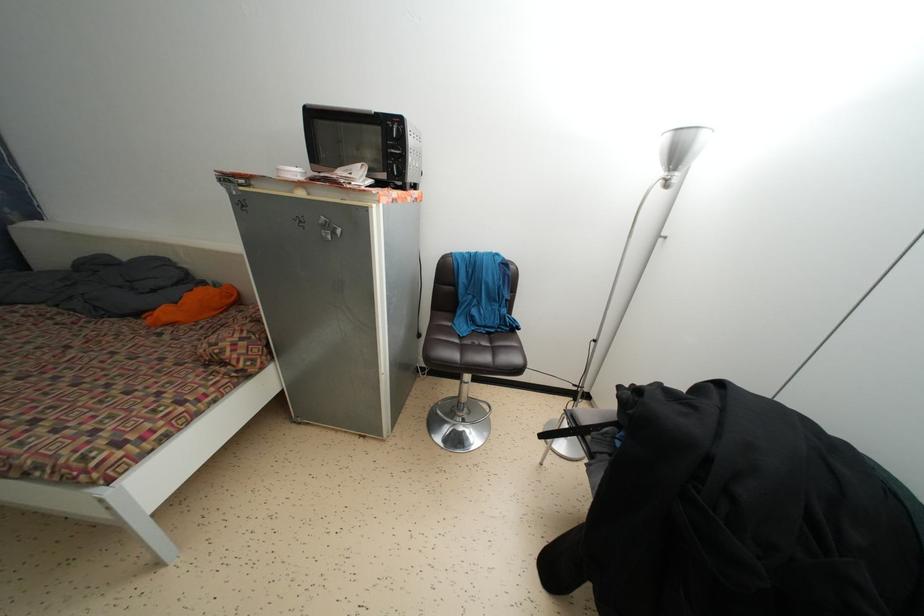
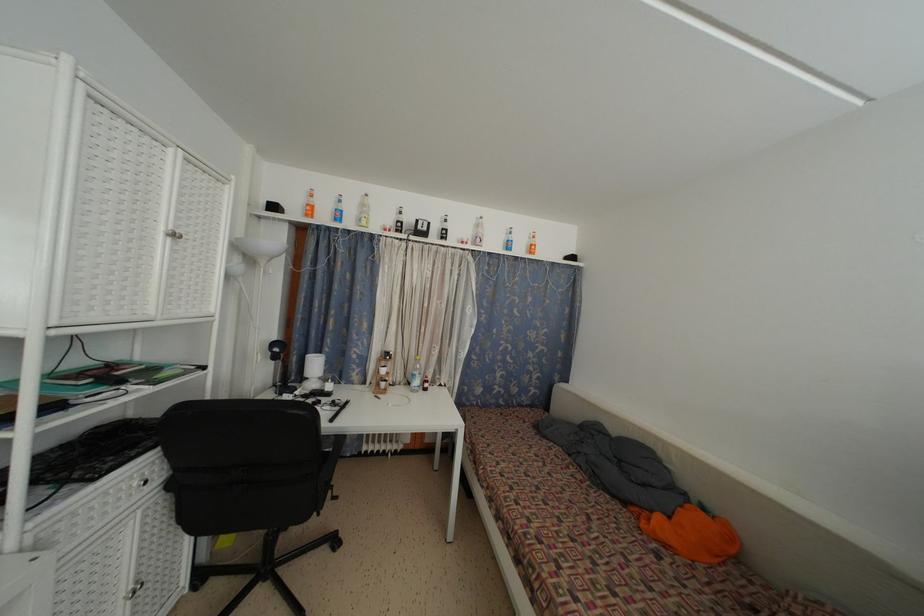
Question: How did the camera likely rotate?

Choices:
 (A) Left
 (B) Right
 (C) Up
 (D) Down

Answer: (A)